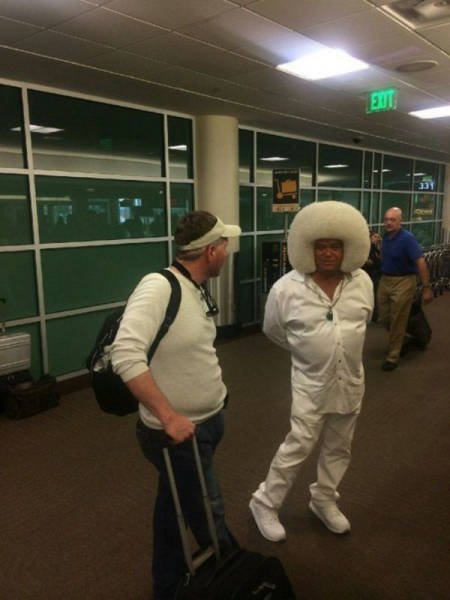
Find the location of `handle`. handle is located at coordinates (167, 448).